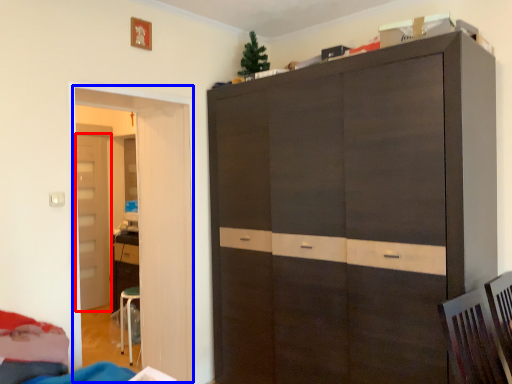
Question: Which object appears farthest to the camera in this image, door (highlighted by a red box) or door (highlighted by a blue box)?

Choices:
 (A) door
 (B) door

Answer: (A)